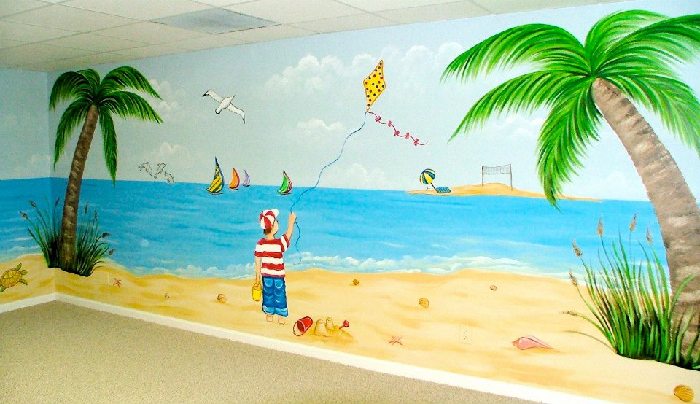
Where is `rug`? rug is located at coordinates (168, 367).